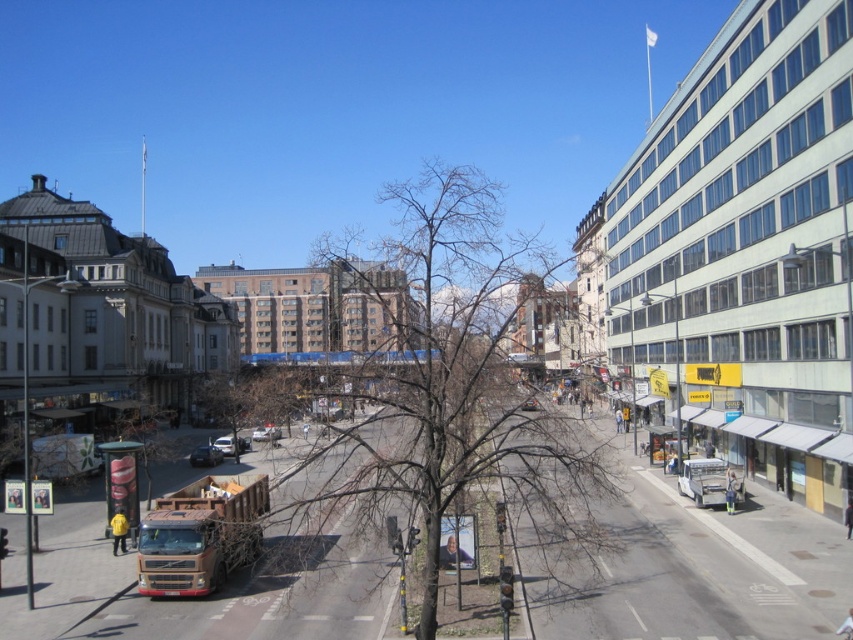
You are a pedestrian standing on the sidewalk and you see the bare branches at center and the metallic silver car at center. Which object is closer to you?

The bare branches at center are closer to you because they are in front of the metallic silver car at center.